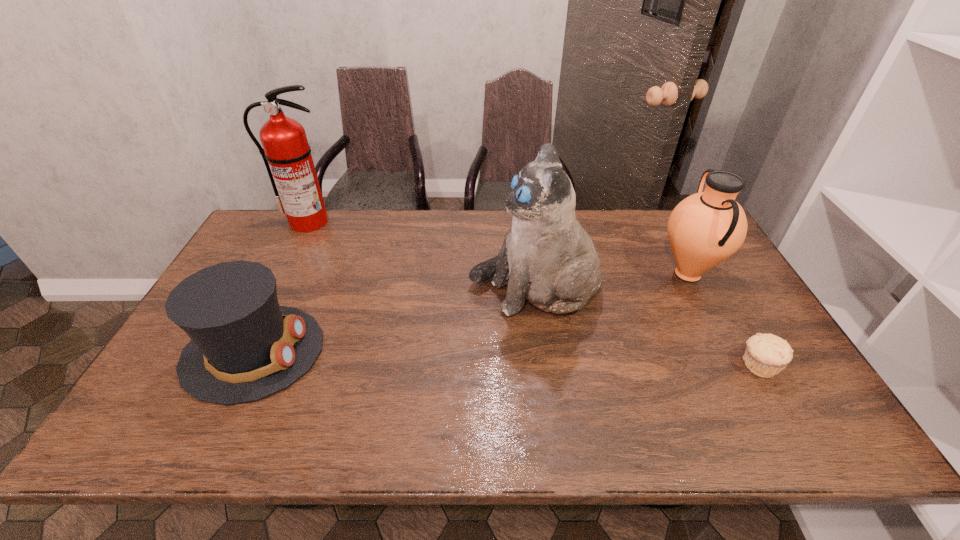
Where is `free space that is in between the third shortest object and the second shortest object`? free space that is in between the third shortest object and the second shortest object is located at coordinates (470, 313).

I want to click on free space between the muffin and the cat, so click(x=646, y=328).

At what (x,y) coordinates should I click in order to perform the action: click on free space between the dress hat and the third tallest object. Please return your answer as a coordinate pair (x, y). Image resolution: width=960 pixels, height=540 pixels. Looking at the image, I should click on (470, 313).

Identify the location of object that is the fourth closest to the fourth tallest object. The width and height of the screenshot is (960, 540). (766, 355).

Identify which object is the third nearest to the shortest object. Please provide its 2D coordinates. Your answer should be formatted as a tuple, i.e. [(x, y)], where the tuple contains the x and y coordinates of a point satisfying the conditions above.

[(244, 347)]

The width and height of the screenshot is (960, 540). I want to click on free space that satisfies the following two spatial constraints: 1. at the nozzle of the farthest object; 2. on the left side of the third shortest object, so click(x=282, y=274).

What are the coordinates of `free location that satisfies the following two spatial constraints: 1. at the nozzle of the farthest object; 2. on the left side of the third tallest object` in the screenshot? It's located at point(282,274).

The image size is (960, 540). Find the location of `vacant space that satisfies the following two spatial constraints: 1. at the nozzle of the fire extinguisher; 2. on the right side of the pitcher`. vacant space that satisfies the following two spatial constraints: 1. at the nozzle of the fire extinguisher; 2. on the right side of the pitcher is located at coordinates (282, 274).

Identify the location of blank space that satisfies the following two spatial constraints: 1. with goggles on the front of the shortest object; 2. on the right side of the dress hat. This screenshot has height=540, width=960. (247, 366).